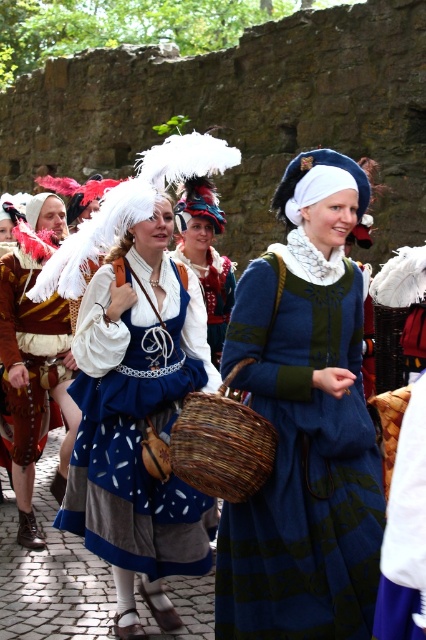
Does blue velvet dress at center have a lesser height compared to woven brown basket at center?

No.

Can you confirm if blue velvet dress at center is positioned above woven brown basket at center?

Yes, blue velvet dress at center is above woven brown basket at center.

What do you see at coordinates (305, 428) in the screenshot? I see `blue velvet dress at center` at bounding box center [305, 428].

The image size is (426, 640). What are the coordinates of `blue velvet dress at center` in the screenshot? It's located at (305, 428).

Is blue velvet dress at center smaller than matte blue dress at center?

Correct, blue velvet dress at center occupies less space than matte blue dress at center.

Find the location of a particular element. blue velvet dress at center is located at coordinates (305, 428).

Between point (250, 352) and point (14, 330), which one is positioned behind?

Point (14, 330)

Does blue velvet dress at center have a lesser height compared to matte white dress at center?

Incorrect, blue velvet dress at center's height does not fall short of matte white dress at center's.

The width and height of the screenshot is (426, 640). What do you see at coordinates (305, 428) in the screenshot?
I see `blue velvet dress at center` at bounding box center [305, 428].

Locate an element on the screen. blue velvet dress at center is located at coordinates pyautogui.click(x=305, y=428).